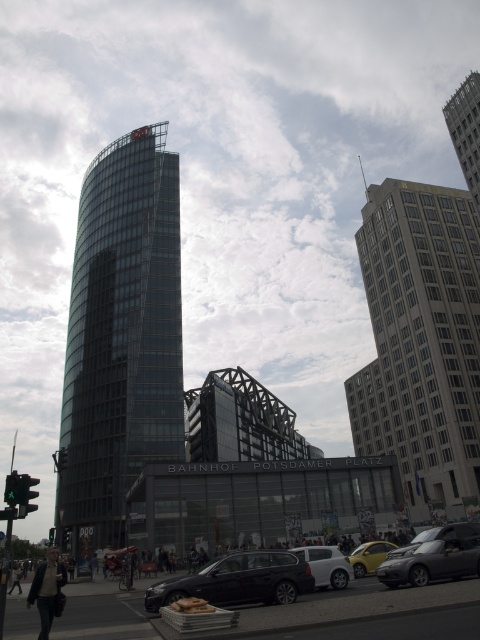
You are a pedestrian waiting at the intersection. You see the shiny black car at lower center and the yellow matte car at lower center. Which car is closer to you?

The shiny black car at lower center is closer to you because it is in front of the yellow matte car at lower center.

You are a delivery person needing to park your 4.5 meter long van between the shiny black car at lower right and the white matte car at center. Is there enough space?

The shiny black car at lower right is 4.62 meters away from the white matte car at center. Since your van is 4.5 meters long, there is enough space to park between them.